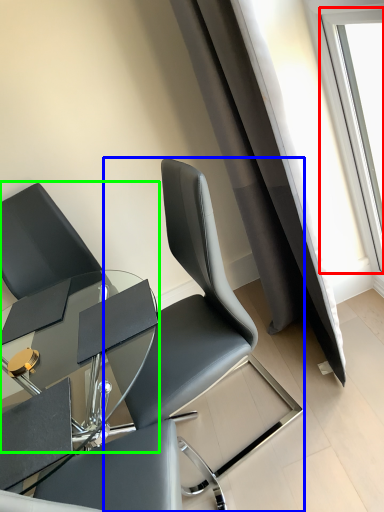
Question: Considering the real-world distances, which object is farthest from window (highlighted by a red box)? chair (highlighted by a blue box) or chair (highlighted by a green box)?

Choices:
 (A) chair
 (B) chair

Answer: (B)